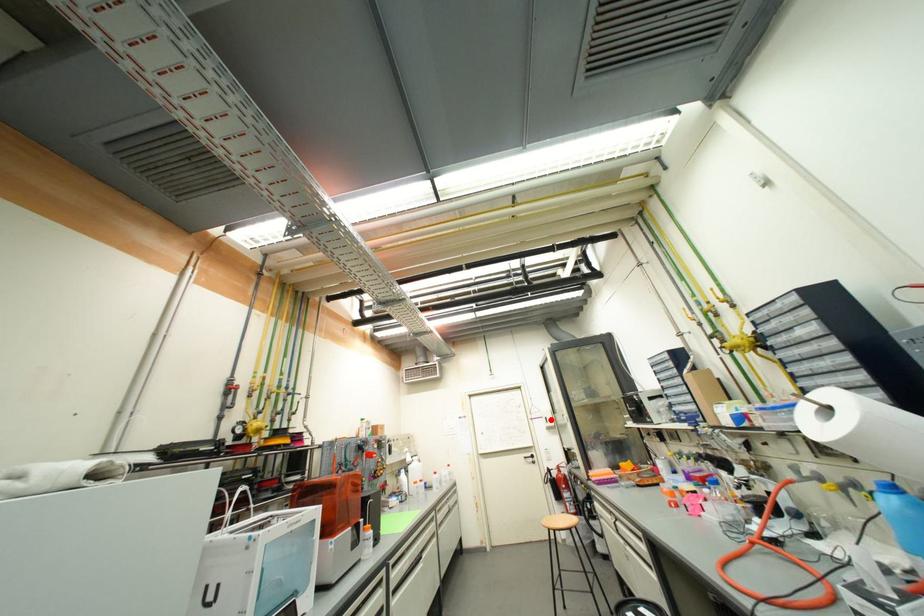
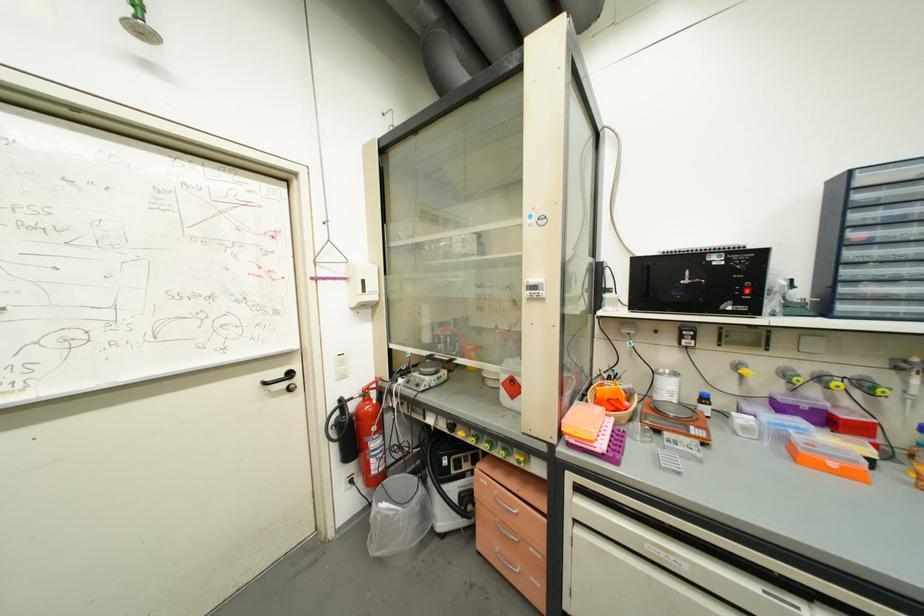
Locate, in the second image, the point that corresponds to the highlighted location in the first image.

(369, 283)